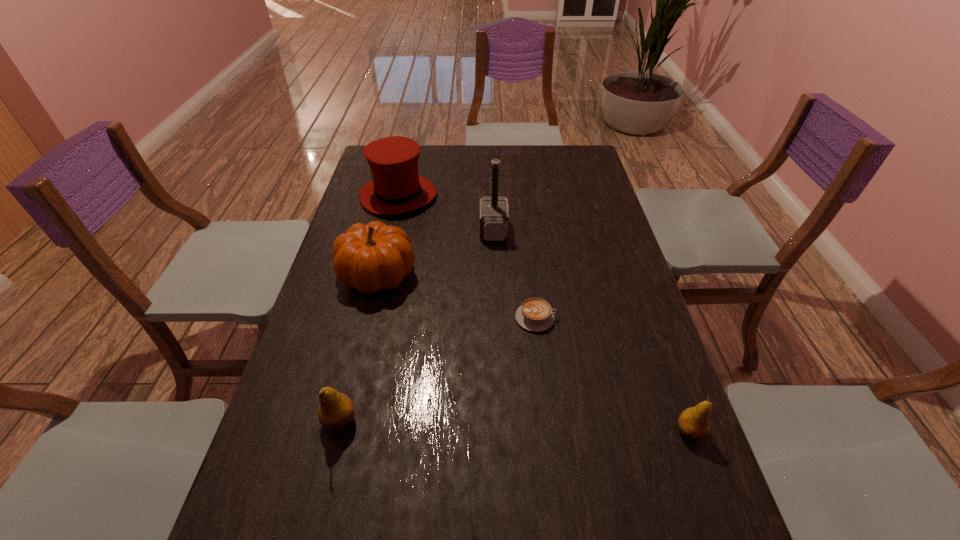
Locate an element on the screen. The height and width of the screenshot is (540, 960). vacant region located on the back of the shorter pear is located at coordinates (647, 315).

You are a GUI agent. You are given a task and a screenshot of the screen. Output one action in this format:
    pyautogui.click(x=<x>, y=<y>)
    Task: Click on the vacant region located for striking with the head of the fourth object from left to right
    This screenshot has height=540, width=960.
    Given the screenshot: What is the action you would take?
    pyautogui.click(x=373, y=230)

Image resolution: width=960 pixels, height=540 pixels. Identify the location of vacant point located for striking with the head of the fourth object from left to right. (431, 230).

Image resolution: width=960 pixels, height=540 pixels. Find the location of `vacant area situated 0.200m for striking with the head of the fourth object from left to right`. vacant area situated 0.200m for striking with the head of the fourth object from left to right is located at coordinates (419, 230).

What are the coordinates of `vacant space located 0.130m on the back of the hat` in the screenshot? It's located at (407, 159).

Where is `vacant space situated on the side of the shortest object with the handle`? vacant space situated on the side of the shortest object with the handle is located at coordinates (x=583, y=318).

Locate an element on the screen. This screenshot has width=960, height=540. vacant space located 0.090m on the front of the third farthest object is located at coordinates (364, 328).

Where is `object that is at the far edge`? object that is at the far edge is located at coordinates pyautogui.click(x=396, y=188).

Find the location of a particular element. pear situated at the left edge is located at coordinates (336, 411).

Locate an element on the screen. hat located at the left edge is located at coordinates pyautogui.click(x=396, y=188).